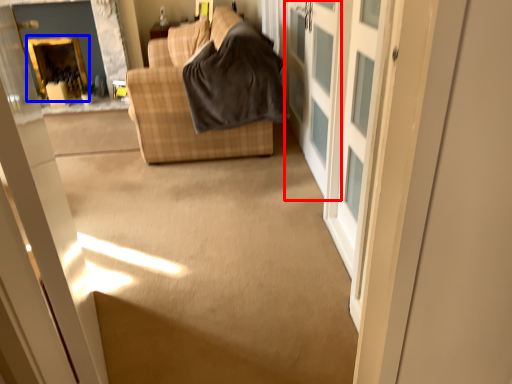
Question: Which object is closer to the camera taking this photo, screen door (highlighted by a red box) or fireplace (highlighted by a blue box)?

Choices:
 (A) screen door
 (B) fireplace

Answer: (A)